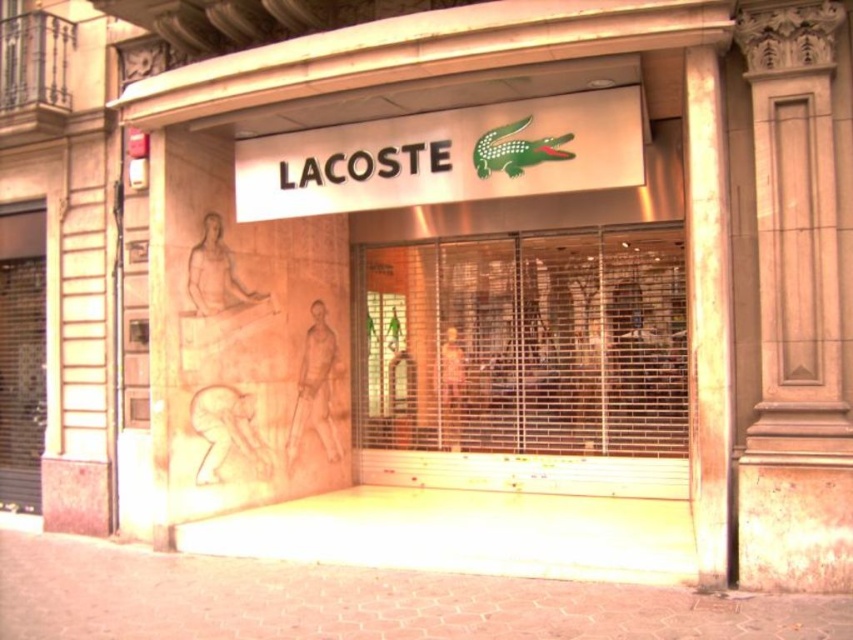
Between smooth stone pillar at right and metallic gate at left, which one appears on the right side from the viewer's perspective?

smooth stone pillar at right

Does smooth stone pillar at right appear over metallic gate at left?

Yes, smooth stone pillar at right is above metallic gate at left.

In order to click on smooth stone pillar at right in this screenshot , I will do `click(706, 314)`.

You are a GUI agent. You are given a task and a screenshot of the screen. Output one action in this format:
    pyautogui.click(x=<x>, y=<y>)
    Task: Click on the smooth stone pillar at right
    Image resolution: width=853 pixels, height=640 pixels.
    Given the screenshot: What is the action you would take?
    pyautogui.click(x=706, y=314)

Which of these two, white glossy sign at center or metallic gate at left, stands taller?

metallic gate at left is taller.

Can you confirm if white glossy sign at center is shorter than metallic gate at left?

Yes, white glossy sign at center is shorter than metallic gate at left.

Which is behind, point (347, 124) or point (10, 492)?

The point (10, 492) is more distant.

Where is `white glossy sign at center`? white glossy sign at center is located at coordinates (445, 156).

Does metallic glass at center lie in front of smooth stone pillar at right?

That is False.

Is metallic glass at center behind smooth stone pillar at right?

That is True.

The image size is (853, 640). I want to click on metallic glass at center, so click(524, 362).